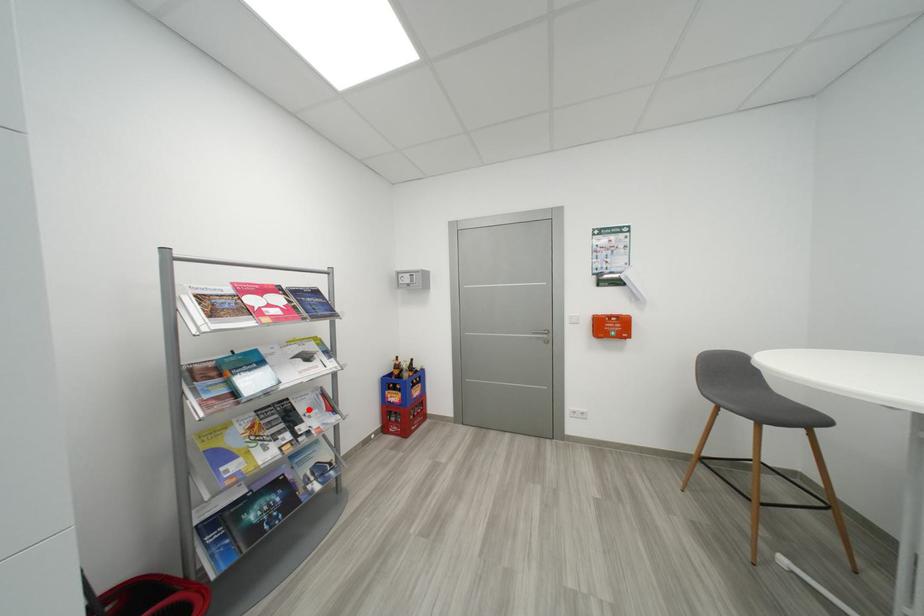
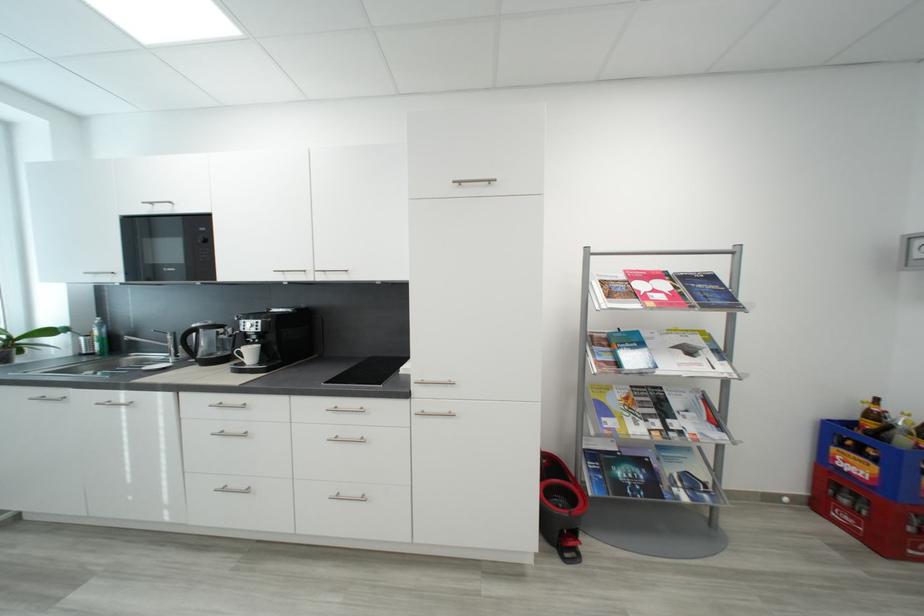
Question: I am providing you with two images of the same scene from different viewpoints. In image1, a red point is highlighted. Considering the same 3D point in image2, which of the following is correct?

Choices:
 (A) It is closer
 (B) It is farther

Answer: (B)